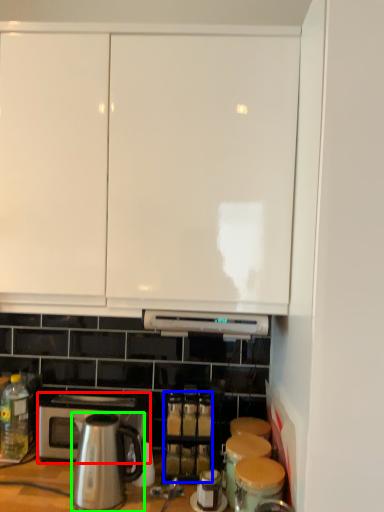
Question: Which is farther away from microwave oven (highlighted by a red box)? beverage (highlighted by a blue box) or kitchen appliance (highlighted by a green box)?

Choices:
 (A) beverage
 (B) kitchen appliance

Answer: (A)